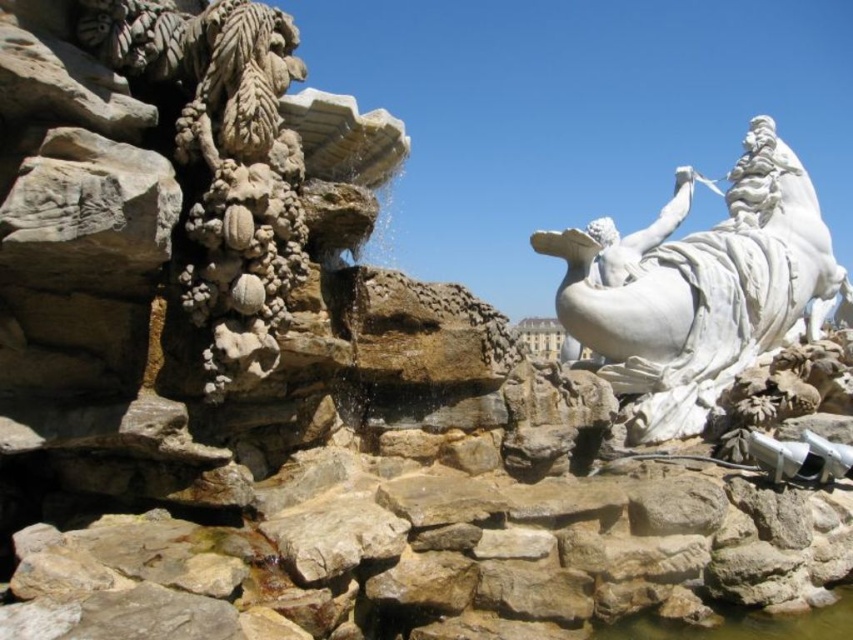
Question: Is white marble statue at right further to camera compared to clear water at rock bottom?

Choices:
 (A) yes
 (B) no

Answer: (A)

Question: Which point appears farthest from the camera in this image?

Choices:
 (A) (730, 349)
 (B) (840, 632)

Answer: (A)

Question: Can you confirm if white marble statue at right is positioned to the right of clear water at rock bottom?

Choices:
 (A) no
 (B) yes

Answer: (B)

Question: Is white marble statue at right to the left of clear water at rock bottom from the viewer's perspective?

Choices:
 (A) no
 (B) yes

Answer: (A)

Question: Which point is closer to the camera?

Choices:
 (A) clear water at rock bottom
 (B) white marble statue at right

Answer: (A)

Question: Which object appears farthest from the camera in this image?

Choices:
 (A) white marble statue at right
 (B) clear water at rock bottom

Answer: (A)